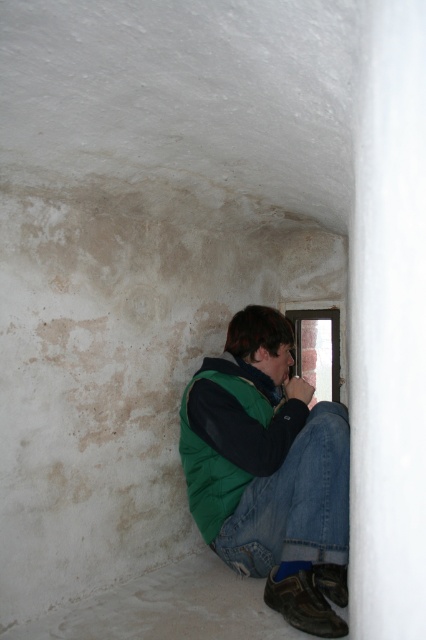
Question: Can you confirm if green puffy vest at lower center is bigger than green puffy jacket at lower center?

Choices:
 (A) no
 (B) yes

Answer: (B)

Question: Which point is closer to the camera taking this photo?

Choices:
 (A) (233, 339)
 (B) (192, 400)

Answer: (B)

Question: Which of the following is the closest to the observer?

Choices:
 (A) (222, 554)
 (B) (249, 404)
 (C) (230, 506)

Answer: (C)

Question: Is green puffy vest at lower center thinner than jeans at lower right?

Choices:
 (A) no
 (B) yes

Answer: (A)

Question: Which object is positioned closest to the jeans at lower right?

Choices:
 (A) green puffy jacket at lower center
 (B) green puffy vest at lower center

Answer: (B)

Question: Observing the image, what is the correct spatial positioning of green puffy vest at lower center in reference to green puffy jacket at lower center?

Choices:
 (A) right
 (B) left

Answer: (A)